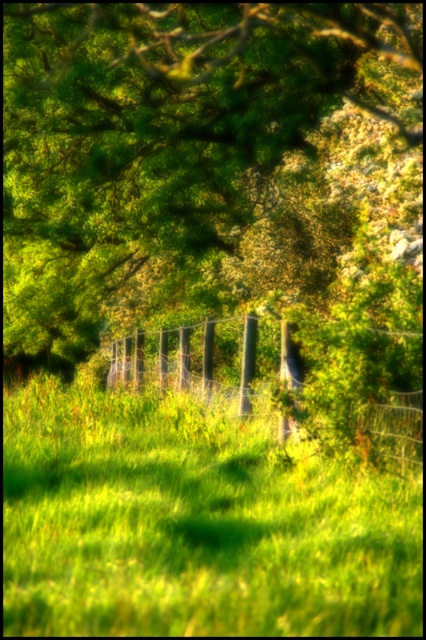
The width and height of the screenshot is (426, 640). What do you see at coordinates (339, 406) in the screenshot? I see `metallic wire fence at center` at bounding box center [339, 406].

The width and height of the screenshot is (426, 640). Find the location of `metallic wire fence at center`. metallic wire fence at center is located at coordinates (339, 406).

Is metallic wire fence at center positioned before smooth wood post at center?

Yes, it is in front of smooth wood post at center.

Between point (293, 385) and point (247, 369), which one is positioned in front?

Point (293, 385)

Is point (120, 368) farther from viewer compared to point (250, 372)?

Yes, it is.

Find the location of `metallic wire fence at center`. metallic wire fence at center is located at coordinates [x=339, y=406].

This screenshot has height=640, width=426. I want to click on green leafy tree at upper center, so click(x=164, y=141).

Is green leafy tree at upper center to the right of metallic wire fence at center from the viewer's perspective?

Incorrect, green leafy tree at upper center is not on the right side of metallic wire fence at center.

The image size is (426, 640). Find the location of `green leafy tree at upper center`. green leafy tree at upper center is located at coordinates (164, 141).

What are the coordinates of `green leafy tree at upper center` in the screenshot? It's located at (164, 141).